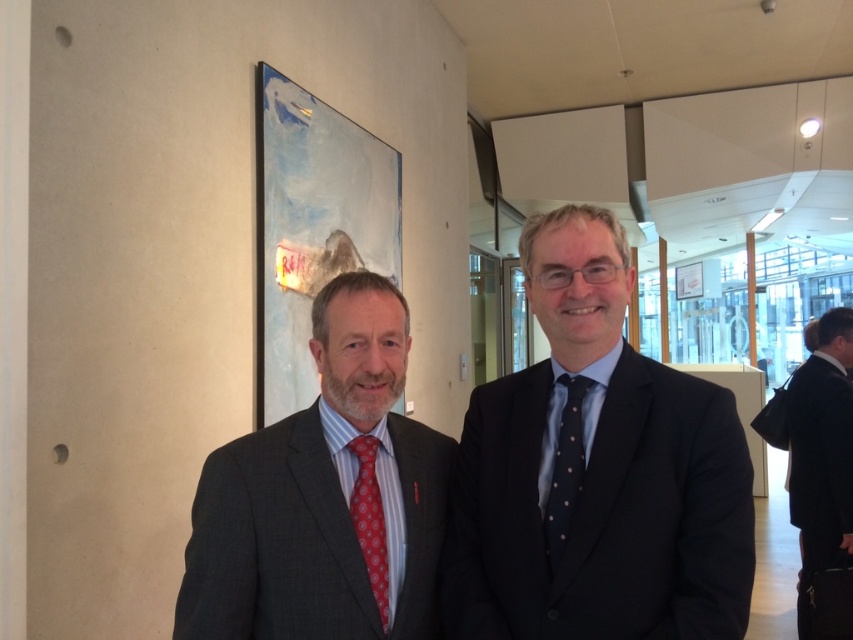
You are a tailor observing two men in a formal setting. You need to determine which tie, the blue dotted fabric tie at center or the red dotted fabric tie at left, requires more fabric vertically. Based on their positions and the scene, which one do you think needs more fabric vertically?

The blue dotted fabric tie at center has a greater height compared to the red dotted fabric tie at left, so it requires more fabric vertically.

You are an event planner arranging a photoshoot for the two men in the image. You need to ensure that the blue dotted fabric tie at center is visible in the final shot. Based on its coordinates, where should you position the camera to capture it clearly?

The blue dotted fabric tie at center is located at point (x=566, y=467), so positioning the camera to focus on that coordinate will ensure the tie is visible.